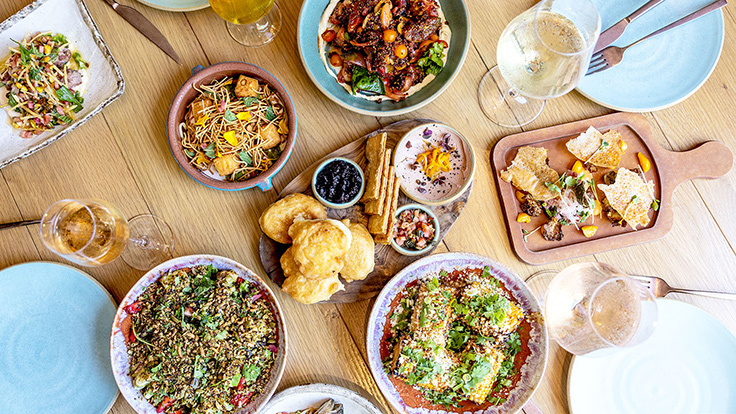
You are a GUI agent. You are given a task and a screenshot of the screen. Output one action in this format:
    pyautogui.click(x=<x>, y=<y>)
    Task: Click on the fork
    The image size is (736, 414).
    Given the screenshot: What is the action you would take?
    658,288, 612,56